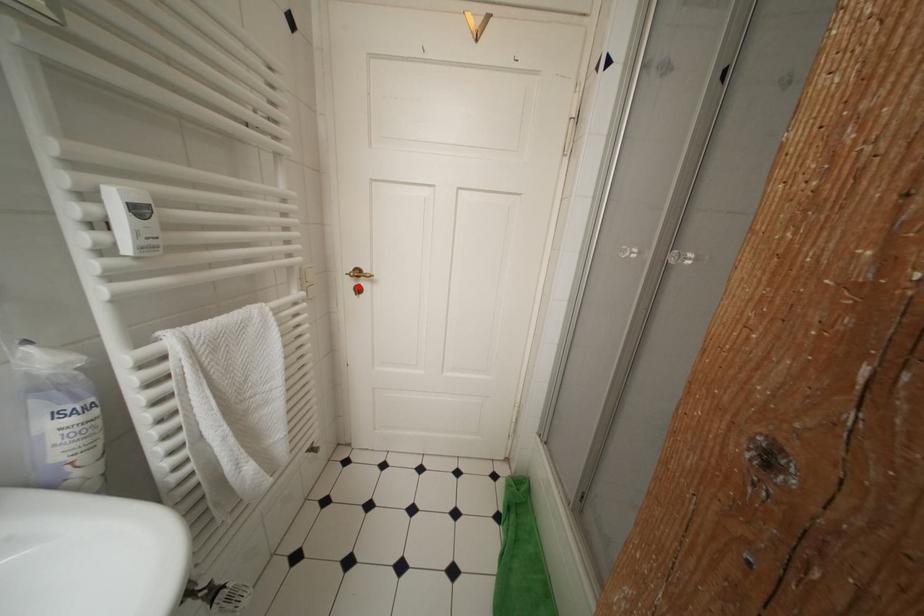
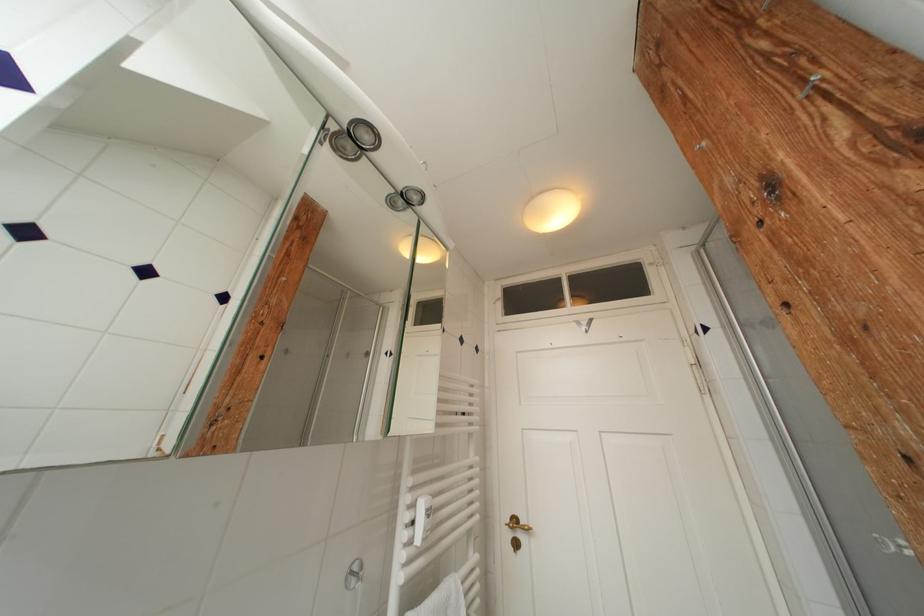
Where in the second image is the point corresponding to the highlighted location from the first image?

(516, 539)